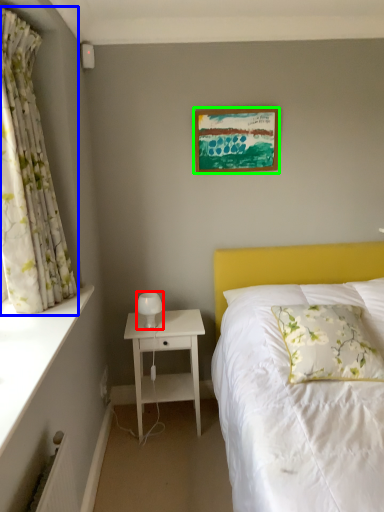
Question: Which is farther away from table lamp (highlighted by a red box)? curtain (highlighted by a blue box) or picture frame (highlighted by a green box)?

Choices:
 (A) curtain
 (B) picture frame

Answer: (B)